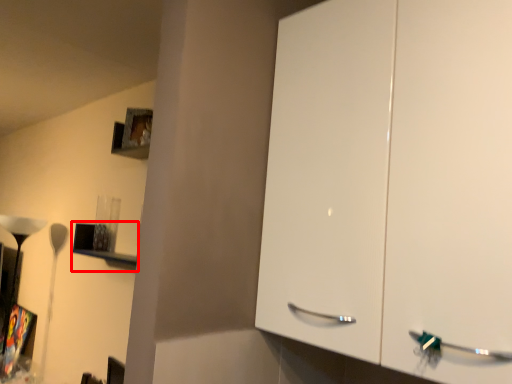
Question: From the image's perspective, what is the correct spatial relationship of shelf (annotated by the red box) in relation to lamp?

Choices:
 (A) below
 (B) above

Answer: (B)